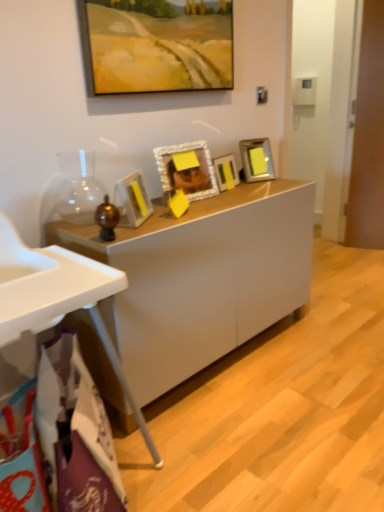
Describe the element at coordinates (226, 172) in the screenshot. I see `metallic silver picture frame at center, which is the 3th picture frame from top to bottom` at that location.

At what (x,y) coordinates should I click in order to perform the action: click on matte yellow picture frame at center, which is the first picture frame in bottom-to-top order. Please return your answer as a coordinate pair (x, y). Image resolution: width=384 pixels, height=512 pixels. Looking at the image, I should click on (133, 201).

This screenshot has height=512, width=384. I want to click on matte yellow painting at upper center, the 1th picture frame from the top, so click(x=156, y=45).

What do you see at coordinates (257, 159) in the screenshot?
I see `metallic silver picture frame at center-right, acting as the 4th picture frame starting from the bottom` at bounding box center [257, 159].

The height and width of the screenshot is (512, 384). In order to click on metallic silver picture frame at center, which is the third picture frame from bottom to top in this screenshot , I will do `click(226, 172)`.

Consider the image. Does white plastic high chair at lower left lie behind matte yellow picture frame at center, which is the first picture frame in bottom-to-top order?

No, white plastic high chair at lower left is in front of matte yellow picture frame at center, which is the first picture frame in bottom-to-top order.

Which object is wider, white plastic high chair at lower left or matte yellow picture frame at center, which is the first picture frame in bottom-to-top order?

white plastic high chair at lower left.

Considering the sizes of white plastic high chair at lower left and matte yellow picture frame at center, which is the first picture frame in bottom-to-top order, in the image, is white plastic high chair at lower left bigger or smaller than matte yellow picture frame at center, which is the first picture frame in bottom-to-top order,?

Clearly, white plastic high chair at lower left is larger in size than matte yellow picture frame at center, which is the first picture frame in bottom-to-top order.

From the image's perspective, count 1st picture frames upward from the white plastic high chair at lower left and point to it. Please provide its 2D coordinates.

[(133, 201)]

Looking at the image, does white glossy cabinet at center seem bigger or smaller compared to metallic silver picture frame at center-right, acting as the 2th picture frame starting from the top?

Clearly, white glossy cabinet at center is larger in size than metallic silver picture frame at center-right, acting as the 2th picture frame starting from the top.

Is point (172, 227) closer to viewer compared to point (247, 156)?

Yes, point (172, 227) is in front of point (247, 156).

Considering the sizes of objects white glossy cabinet at center and metallic silver picture frame at center-right, acting as the 4th picture frame starting from the bottom, in the image provided, who is wider, white glossy cabinet at center or metallic silver picture frame at center-right, acting as the 4th picture frame starting from the bottom,?

With larger width is white glossy cabinet at center.

Considering the relative positions of white glossy cabinet at center and metallic silver picture frame at center-right, acting as the 4th picture frame starting from the bottom, in the image provided, is white glossy cabinet at center to the left or to the right of metallic silver picture frame at center-right, acting as the 4th picture frame starting from the bottom,?

white glossy cabinet at center is positioned on metallic silver picture frame at center-right, acting as the 4th picture frame starting from the bottom,'s left side.

Which object is further away from the camera taking this photo, white glossy cabinet at center or matte yellow painting at upper center, the fifth picture frame positioned from the bottom?

matte yellow painting at upper center, the fifth picture frame positioned from the bottom, is behind.

Is white glossy cabinet at center inside or outside of matte yellow painting at upper center, the fifth picture frame positioned from the bottom?

white glossy cabinet at center is not inside matte yellow painting at upper center, the fifth picture frame positioned from the bottom, it's outside.

Consider the image. Could you measure the distance between white glossy cabinet at center and matte yellow painting at upper center, the fifth picture frame positioned from the bottom?

A distance of 30.49 inches exists between white glossy cabinet at center and matte yellow painting at upper center, the fifth picture frame positioned from the bottom.

Is white glossy cabinet at center oriented towards matte yellow painting at upper center, the 1th picture frame from the top?

No, white glossy cabinet at center is not aimed at matte yellow painting at upper center, the 1th picture frame from the top.

How different are the orientations of white plastic high chair at lower left and metallic silver picture frame at center-right, acting as the 2th picture frame starting from the top, in degrees?

22 degrees.

Is white plastic high chair at lower left not near metallic silver picture frame at center-right, acting as the 2th picture frame starting from the top?

white plastic high chair at lower left is positioned a significant distance from metallic silver picture frame at center-right, acting as the 2th picture frame starting from the top.

From the image's perspective, who appears lower, white plastic high chair at lower left or metallic silver picture frame at center-right, acting as the 4th picture frame starting from the bottom?

white plastic high chair at lower left is shown below in the image.

Could you tell me if white plastic high chair at lower left is turned towards metallic silver picture frame at center-right, acting as the 2th picture frame starting from the top?

No, white plastic high chair at lower left is not oriented towards metallic silver picture frame at center-right, acting as the 2th picture frame starting from the top.

Does matte yellow picture frame at center, which is the first picture frame in bottom-to-top order, have a lesser height compared to white textured picture frame at center, which ranks as the second picture frame in bottom-to-top order?

Correct, matte yellow picture frame at center, which is the first picture frame in bottom-to-top order, is not as tall as white textured picture frame at center, which ranks as the second picture frame in bottom-to-top order.

From the image's perspective, is matte yellow picture frame at center, which appears as the 5th picture frame when viewed from the top, above or below white textured picture frame at center, placed as the 4th picture frame when sorted from top to bottom?

Based on their image positions, matte yellow picture frame at center, which appears as the 5th picture frame when viewed from the top, is located beneath white textured picture frame at center, placed as the 4th picture frame when sorted from top to bottom.

Would you consider matte yellow picture frame at center, which is the first picture frame in bottom-to-top order, to be distant from white textured picture frame at center, placed as the 4th picture frame when sorted from top to bottom?

Actually, matte yellow picture frame at center, which is the first picture frame in bottom-to-top order, and white textured picture frame at center, placed as the 4th picture frame when sorted from top to bottom, are a little close together.

How distant is metallic silver picture frame at center, which is the 3th picture frame from top to bottom, from white plastic high chair at lower left?

3.30 feet.

Considering the relative positions of metallic silver picture frame at center, which is the third picture frame from bottom to top, and white plastic high chair at lower left in the image provided, is metallic silver picture frame at center, which is the third picture frame from bottom to top, to the right of white plastic high chair at lower left from the viewer's perspective?

Yes, metallic silver picture frame at center, which is the third picture frame from bottom to top, is to the right of white plastic high chair at lower left.

From a real-world perspective, does metallic silver picture frame at center, which is the third picture frame from bottom to top, sit lower than white plastic high chair at lower left?

No, from a real-world perspective, metallic silver picture frame at center, which is the third picture frame from bottom to top, is not beneath white plastic high chair at lower left.

Is white glossy cabinet at center far away from matte yellow picture frame at center, which is the first picture frame in bottom-to-top order?

white glossy cabinet at center is near matte yellow picture frame at center, which is the first picture frame in bottom-to-top order, not far away.

Which is less distant, (208, 230) or (141, 220)?

Positioned in front is point (141, 220).

From the image's perspective, would you say white glossy cabinet at center is shown under matte yellow picture frame at center, which appears as the 5th picture frame when viewed from the top?

Yes, from the image's perspective, white glossy cabinet at center is beneath matte yellow picture frame at center, which appears as the 5th picture frame when viewed from the top.

Which picture frame is the 2nd one when counting from the back of the white plastic high chair at lower left? Please provide its 2D coordinates.

[(133, 201)]

Locate an element on the screen. The image size is (384, 512). desk located below the metallic silver picture frame at center-right, acting as the 2th picture frame starting from the top (from the image's perspective) is located at coordinates (201, 278).

From the image, which object appears to be farther from metallic silver picture frame at center, which is the third picture frame from bottom to top, matte yellow painting at upper center, the fifth picture frame positioned from the bottom, or white plastic high chair at lower left?

white plastic high chair at lower left lies further to metallic silver picture frame at center, which is the third picture frame from bottom to top, than the other object.

Based on their spatial positions, is metallic silver picture frame at center-right, acting as the 2th picture frame starting from the top, or white plastic high chair at lower left closer to white textured picture frame at center, placed as the 4th picture frame when sorted from top to bottom?

metallic silver picture frame at center-right, acting as the 2th picture frame starting from the top, is closer to white textured picture frame at center, placed as the 4th picture frame when sorted from top to bottom.

When comparing their distances from matte yellow picture frame at center, which is the first picture frame in bottom-to-top order, does white glossy cabinet at center or matte yellow painting at upper center, the 1th picture frame from the top, seem closer?

The object closer to matte yellow picture frame at center, which is the first picture frame in bottom-to-top order, is white glossy cabinet at center.

When comparing their distances from white plastic high chair at lower left, does matte yellow painting at upper center, the fifth picture frame positioned from the bottom, or white textured picture frame at center, which ranks as the second picture frame in bottom-to-top order, seem further?

The object further to white plastic high chair at lower left is matte yellow painting at upper center, the fifth picture frame positioned from the bottom.

Estimate the real-world distances between objects in this image. Which object is closer to white glossy cabinet at center, white plastic high chair at lower left or metallic silver picture frame at center-right, acting as the 2th picture frame starting from the top?

The object closer to white glossy cabinet at center is white plastic high chair at lower left.

When comparing their distances from white plastic high chair at lower left, does white textured picture frame at center, placed as the 4th picture frame when sorted from top to bottom, or metallic silver picture frame at center, which is the 3th picture frame from top to bottom, seem further?

metallic silver picture frame at center, which is the 3th picture frame from top to bottom, is positioned further to the anchor white plastic high chair at lower left.

When comparing their distances from white glossy cabinet at center, does white plastic high chair at lower left or white textured picture frame at center, which ranks as the second picture frame in bottom-to-top order, seem closer?

white textured picture frame at center, which ranks as the second picture frame in bottom-to-top order, is positioned closer to the anchor white glossy cabinet at center.

Looking at the image, which one is located closer to matte yellow painting at upper center, the 1th picture frame from the top, matte yellow picture frame at center, which appears as the 5th picture frame when viewed from the top, or metallic silver picture frame at center-right, acting as the 2th picture frame starting from the top?

matte yellow picture frame at center, which appears as the 5th picture frame when viewed from the top, is closer to matte yellow painting at upper center, the 1th picture frame from the top.

Locate an element on the screen. desk between white plastic high chair at lower left and white textured picture frame at center, which ranks as the second picture frame in bottom-to-top order, in the front-back direction is located at coordinates (201, 278).

This screenshot has height=512, width=384. I want to click on picture frame between white textured picture frame at center, placed as the 4th picture frame when sorted from top to bottom, and white glossy cabinet at center from top to bottom, so click(x=133, y=201).

In order to click on desk between white plastic high chair at lower left and metallic silver picture frame at center-right, acting as the 2th picture frame starting from the top, in the front-back direction in this screenshot , I will do `click(201, 278)`.

Find the location of `picture frame located between white textured picture frame at center, which ranks as the second picture frame in bottom-to-top order, and metallic silver picture frame at center-right, acting as the 2th picture frame starting from the top, in the depth direction`. picture frame located between white textured picture frame at center, which ranks as the second picture frame in bottom-to-top order, and metallic silver picture frame at center-right, acting as the 2th picture frame starting from the top, in the depth direction is located at coordinates (226, 172).